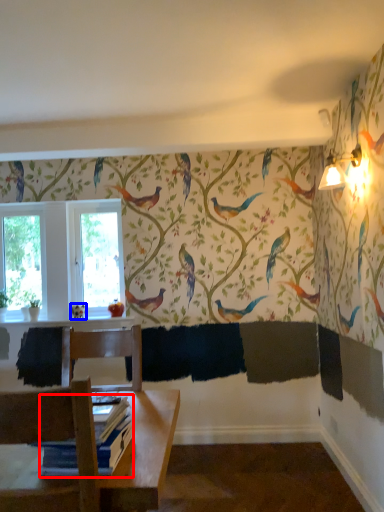
Question: Which of the following is the farthest to the observer, book (highlighted by a red box) or bird (highlighted by a blue box)?

Choices:
 (A) book
 (B) bird

Answer: (B)